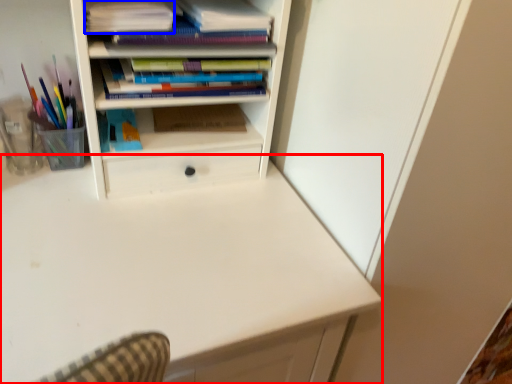
Question: Which object is further to the camera taking this photo, computer desk (highlighted by a red box) or book (highlighted by a blue box)?

Choices:
 (A) computer desk
 (B) book

Answer: (B)